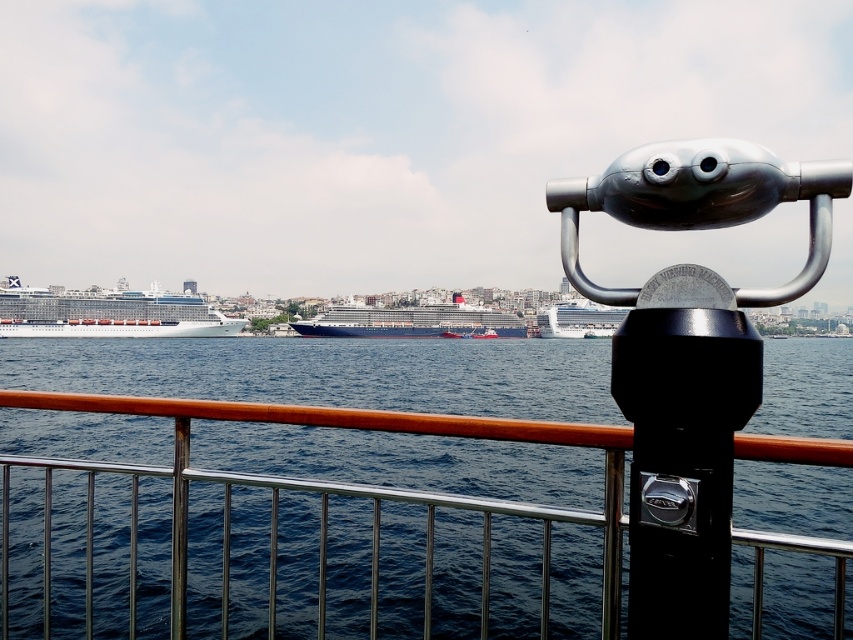
Question: Is blue metallic cruise ship at center positioned at the back of white glossy cruise ship at center?

Choices:
 (A) no
 (B) yes

Answer: (B)

Question: Which object is closer to the camera taking this photo?

Choices:
 (A) blue metallic cruise ship at left
 (B) dark blue water at center
 (C) blue metallic cruise ship at center
 (D) white glossy cruise ship at center

Answer: (B)

Question: Is blue metallic cruise ship at left wider than white glossy cruise ship at center?

Choices:
 (A) no
 (B) yes

Answer: (A)

Question: Estimate the real-world distances between objects in this image. Which object is closer to the blue metallic cruise ship at center?

Choices:
 (A) blue metallic cruise ship at left
 (B) white glossy cruise ship at center

Answer: (B)

Question: Which point is farther to the camera?

Choices:
 (A) (563, 337)
 (B) (228, 317)
 (C) (323, 317)

Answer: (A)

Question: Is blue metallic cruise ship at left thinner than white glossy cruise ship at center?

Choices:
 (A) no
 (B) yes

Answer: (B)